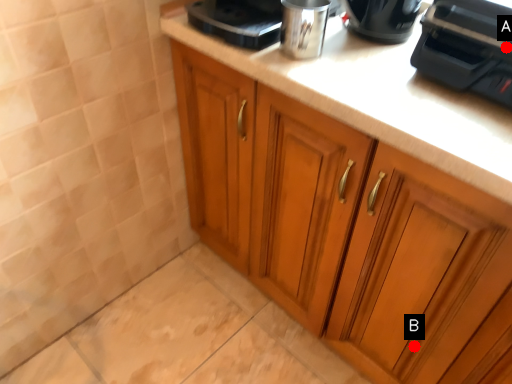
Question: Two points are circled on the image, labeled by A and B beside each circle. Which point is further to the camera?

Choices:
 (A) A is further
 (B) B is further

Answer: (B)